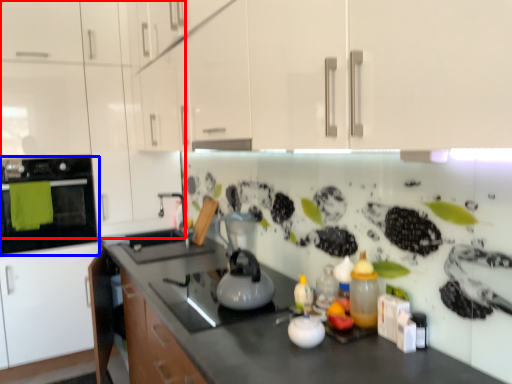
Question: Among these objects, which one is nearest to the camera, cabinetry (highlighted by a red box) or home appliance (highlighted by a blue box)?

Choices:
 (A) cabinetry
 (B) home appliance

Answer: (A)